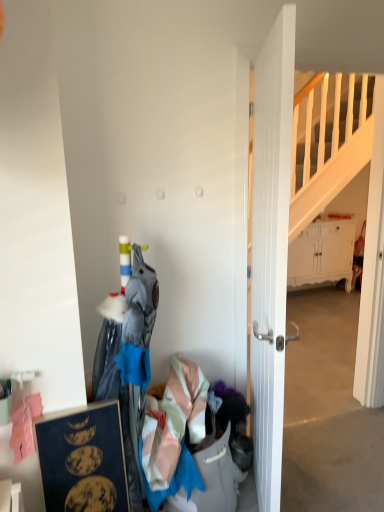
The height and width of the screenshot is (512, 384). Identify the location of dark blue matte picture frame at lower left. (83, 460).

This screenshot has width=384, height=512. Describe the element at coordinates (83, 460) in the screenshot. I see `dark blue matte picture frame at lower left` at that location.

The image size is (384, 512). Describe the element at coordinates (322, 254) in the screenshot. I see `white matte cabinet at right` at that location.

Find the location of a particular element. white wooden door at center is located at coordinates (270, 251).

Is white matte cabinet at right directly adjacent to dark blue matte picture frame at lower left?

No, white matte cabinet at right is not with dark blue matte picture frame at lower left.

Considering the positions of objects white matte cabinet at right and dark blue matte picture frame at lower left in the image provided, who is behind, white matte cabinet at right or dark blue matte picture frame at lower left?

white matte cabinet at right is behind.

Is white matte cabinet at right thinner than dark blue matte picture frame at lower left?

No.

Is white matte cabinet at right shorter than dark blue matte picture frame at lower left?

No.

What's the angular difference between light pink satin dress at lower center and dark blue matte picture frame at lower left's facing directions?

The angular difference between light pink satin dress at lower center and dark blue matte picture frame at lower left is 3.47 degrees.

Which point is more forward, (201, 480) or (76, 446)?

The point (76, 446) is more forward.

From a real-world perspective, is light pink satin dress at lower center physically above dark blue matte picture frame at lower left?

No, from a real-world perspective, light pink satin dress at lower center is not above dark blue matte picture frame at lower left.

Does white wooden door at center have a lesser height compared to light pink satin dress at lower center?

No.

Considering the positions of objects white wooden door at center and light pink satin dress at lower center in the image provided, who is behind, white wooden door at center or light pink satin dress at lower center?

light pink satin dress at lower center is further away from the camera.

Looking at their sizes, would you say white wooden door at center is wider or thinner than light pink satin dress at lower center?

Considering their sizes, white wooden door at center looks slimmer than light pink satin dress at lower center.

From the image's perspective, does white wooden door at center appear lower than light pink satin dress at lower center?

Actually, white wooden door at center appears above light pink satin dress at lower center in the image.

Considering the sizes of light pink satin dress at lower center and white wooden door at center in the image, is light pink satin dress at lower center bigger or smaller than white wooden door at center?

light pink satin dress at lower center is smaller than white wooden door at center.

Does light pink satin dress at lower center turn towards white wooden door at center?

No.

Is light pink satin dress at lower center touching white wooden door at center?

light pink satin dress at lower center is not next to white wooden door at center, and they're not touching.

Can you tell me how much light pink satin dress at lower center and white wooden door at center differ in facing direction?

The facing directions of light pink satin dress at lower center and white wooden door at center are 66.6 degrees apart.

Is white wooden door at center wider or thinner than white matte cabinet at right?

In the image, white wooden door at center appears to be more narrow than white matte cabinet at right.

Which object is further away from the camera taking this photo, white wooden door at center or white matte cabinet at right?

white matte cabinet at right.

Is white matte cabinet at right located within white wooden door at center?

No, white matte cabinet at right is not surrounded by white wooden door at center.

From the image's perspective, which is below, white wooden door at center or white matte cabinet at right?

white wooden door at center appears lower in the image.

From the image's perspective, is dark blue matte picture frame at lower left located above or below white wooden door at center?

Clearly, from the image's perspective, dark blue matte picture frame at lower left is below white wooden door at center.

Could you tell me if dark blue matte picture frame at lower left is turned towards white wooden door at center?

No, dark blue matte picture frame at lower left is not facing towards white wooden door at center.

Consider the image. Is dark blue matte picture frame at lower left wider than white wooden door at center?

Correct, the width of dark blue matte picture frame at lower left exceeds that of white wooden door at center.

Which of these two, white matte cabinet at right or white wooden door at center, is smaller?

With smaller size is white wooden door at center.

From the image's perspective, who appears lower, white matte cabinet at right or white wooden door at center?

white wooden door at center appears lower in the image.

From a real-world perspective, is white matte cabinet at right on top of white wooden door at center?

No, from a real-world perspective, white matte cabinet at right is not above white wooden door at center.

You are a GUI agent. You are given a task and a screenshot of the screen. Output one action in this format:
    pyautogui.click(x=<x>, y=<y>)
    Task: Click on the picture frame below the white matte cabinet at right (from the image's perspective)
    The width and height of the screenshot is (384, 512).
    Given the screenshot: What is the action you would take?
    pyautogui.click(x=83, y=460)

Find the location of `clothing behind the dark blue matte picture frame at lower left`. clothing behind the dark blue matte picture frame at lower left is located at coordinates (174, 434).

Looking at the image, which one is located closer to white matte cabinet at right, light pink satin dress at lower center or dark blue matte picture frame at lower left?

light pink satin dress at lower center is closer to white matte cabinet at right.

From the image, which object appears to be nearer to white wooden door at center, light pink satin dress at lower center or dark blue matte picture frame at lower left?

light pink satin dress at lower center is positioned closer to the anchor white wooden door at center.

Based on their spatial positions, is dark blue matte picture frame at lower left or white wooden door at center further from white matte cabinet at right?

dark blue matte picture frame at lower left is positioned further to the anchor white matte cabinet at right.

Estimate the real-world distances between objects in this image. Which object is further from white matte cabinet at right, white wooden door at center or dark blue matte picture frame at lower left?

The object further to white matte cabinet at right is dark blue matte picture frame at lower left.

Based on their spatial positions, is dark blue matte picture frame at lower left or white matte cabinet at right further from light pink satin dress at lower center?

white matte cabinet at right lies further to light pink satin dress at lower center than the other object.

Estimate the real-world distances between objects in this image. Which object is further from light pink satin dress at lower center, white matte cabinet at right or white wooden door at center?

white matte cabinet at right lies further to light pink satin dress at lower center than the other object.

Considering their positions, is light pink satin dress at lower center positioned further to white wooden door at center than white matte cabinet at right?

white matte cabinet at right is positioned further to the anchor white wooden door at center.

Which object lies nearer to the anchor point dark blue matte picture frame at lower left, white matte cabinet at right or white wooden door at center?

Based on the image, white wooden door at center appears to be nearer to dark blue matte picture frame at lower left.

The height and width of the screenshot is (512, 384). Find the location of `clothing between dark blue matte picture frame at lower left and white matte cabinet at right from front to back`. clothing between dark blue matte picture frame at lower left and white matte cabinet at right from front to back is located at coordinates (174, 434).

At what (x,y) coordinates should I click in order to perform the action: click on picture frame positioned between white wooden door at center and white matte cabinet at right from near to far. Please return your answer as a coordinate pair (x, y). Looking at the image, I should click on (83, 460).

Locate an element on the screen. The width and height of the screenshot is (384, 512). picture frame between white wooden door at center and light pink satin dress at lower center from top to bottom is located at coordinates (83, 460).

Find the location of a particular element. The height and width of the screenshot is (512, 384). clothing between white wooden door at center and white matte cabinet at right along the z-axis is located at coordinates click(x=174, y=434).